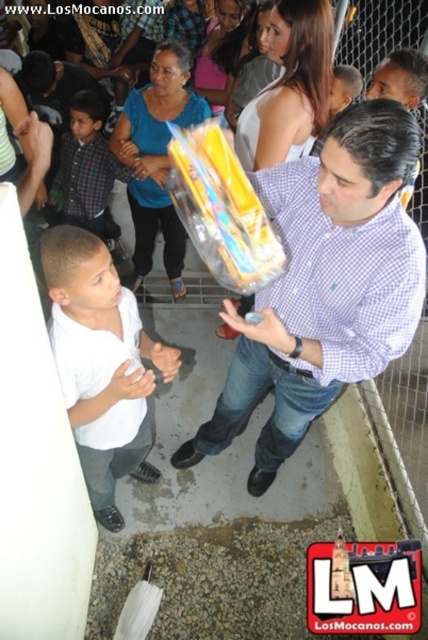
Does white matte shirt at lower left appear over plaid fabric shirt at left?

Incorrect, white matte shirt at lower left is not positioned above plaid fabric shirt at left.

Can you confirm if white matte shirt at lower left is shorter than plaid fabric shirt at left?

No.

Is point (92, 291) more distant than point (103, 234)?

That is False.

The image size is (428, 640). Find the location of `white matte shirt at lower left`. white matte shirt at lower left is located at coordinates (101, 362).

Who is lower down, matte plastic toy at center or plaid fabric shirt at left?

matte plastic toy at center

Does matte plastic toy at center have a lesser width compared to plaid fabric shirt at left?

No.

In order to click on matte plastic toy at center in this screenshot , I will do `click(324, 285)`.

The height and width of the screenshot is (640, 428). In order to click on matte plastic toy at center in this screenshot , I will do `click(324, 285)`.

Can you confirm if matte plastic toy at center is positioned above white matte shirt at lower left?

Yes, matte plastic toy at center is above white matte shirt at lower left.

Who is positioned more to the left, matte plastic toy at center or white matte shirt at lower left?

From the viewer's perspective, white matte shirt at lower left appears more on the left side.

You are a GUI agent. You are given a task and a screenshot of the screen. Output one action in this format:
    pyautogui.click(x=<x>, y=<y>)
    Task: Click on the matte plastic toy at center
    The height and width of the screenshot is (640, 428).
    Given the screenshot: What is the action you would take?
    pyautogui.click(x=324, y=285)